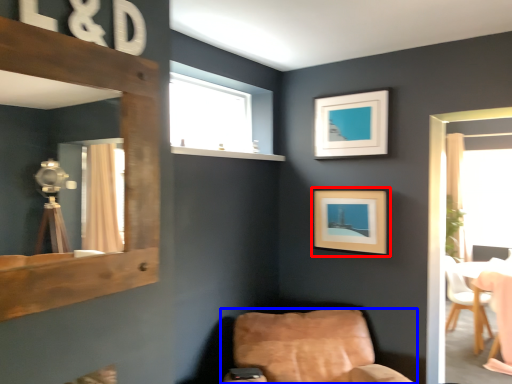
Question: Which object is closer to the camera taking this photo, picture frame (highlighted by a red box) or chair (highlighted by a blue box)?

Choices:
 (A) picture frame
 (B) chair

Answer: (B)